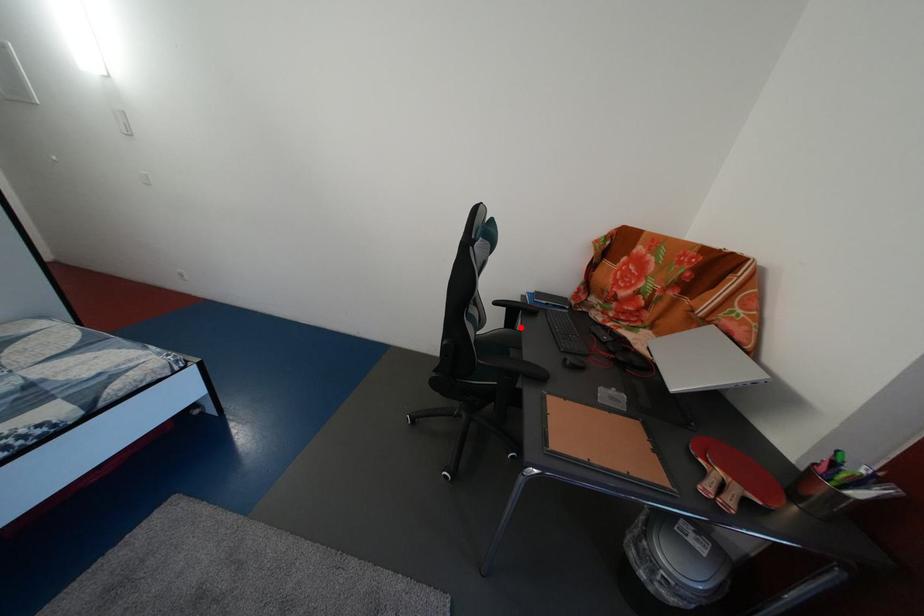
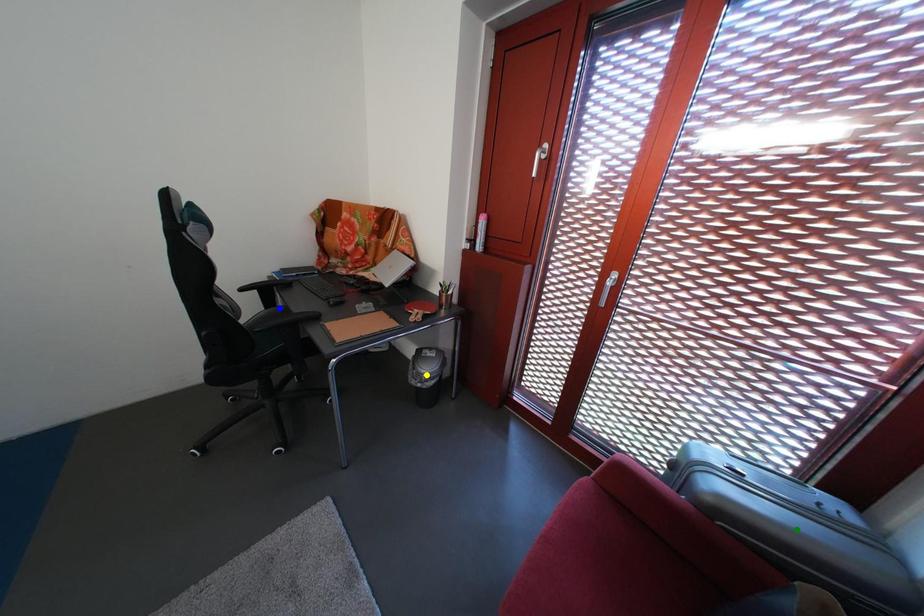
Question: I am providing you with two images of the same scene from different viewpoints. A red point is marked on the first image. You are given multiple points on the second image. Which spot in image 2 lines up with the point in image 1?

Choices:
 (A) blue point
 (B) green point
 (C) yellow point

Answer: (A)